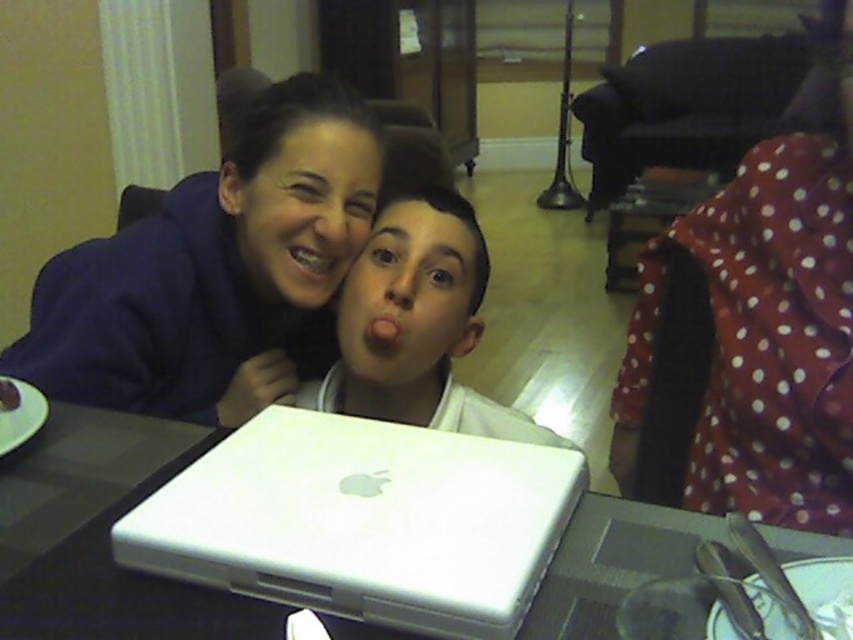
You are a photographer setting up a shot of the scene. You need to place a light source at the point marked by coordinates point (316, 260). Where exactly should you position the light source relative to the white Apple laptop and the two people?

The point (316, 260) marks the metallic braces at center. Therefore, you should position the light source at the metallic braces at center, which is between the white Apple laptop on the table and the two people seated behind it.

You are a photographer taking a picture of the matte blue hoodie at upper left and the matte white mouth at center. Which object should you focus on first if you want to capture both in the same frame without moving the camera?

You should focus on the matte blue hoodie at upper left first because it is positioned to the left of the matte white mouth at center, allowing both to be captured in the frame without moving the camera.

From the picture: You are a photographer trying to capture a candid shot of the matte white mouth at center and the metallic braces at center. Since you want to ensure both are in focus, which object should you focus on first according to their positions?

The matte white mouth at center is behind metallic braces at center, so you should focus on the metallic braces at center first to ensure both are in focus.